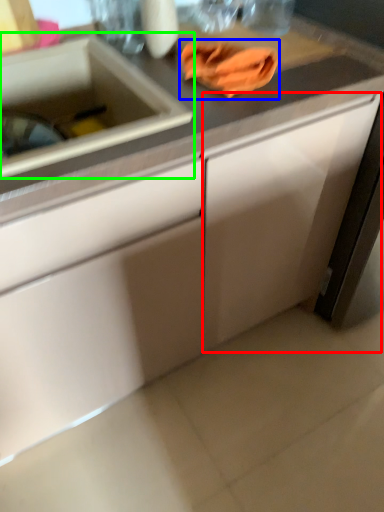
Question: Estimate the real-world distances between objects in this image. Which object is closer to cabinetry (highlighted by a red box), hand towel (highlighted by a blue box) or sink (highlighted by a green box)?

Choices:
 (A) hand towel
 (B) sink

Answer: (A)